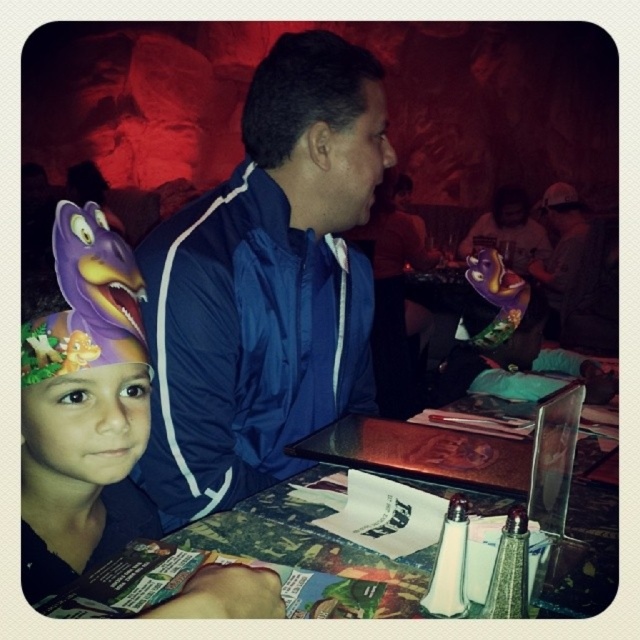
Question: Is blue nylon jacket at center in front of purple fabric headband at left?

Choices:
 (A) no
 (B) yes

Answer: (A)

Question: Among these points, which one is farthest from the camera?

Choices:
 (A) (67, 563)
 (B) (342, 129)

Answer: (B)

Question: Which point appears farthest from the camera in this image?

Choices:
 (A) (304, 38)
 (B) (60, 230)

Answer: (A)

Question: Can you confirm if blue nylon jacket at center is thinner than purple fabric headband at left?

Choices:
 (A) yes
 (B) no

Answer: (B)

Question: Among these points, which one is nearest to the camera?

Choices:
 (A) (353, 164)
 (B) (24, 490)

Answer: (B)

Question: Is blue nylon jacket at center wider than purple fabric headband at left?

Choices:
 (A) no
 (B) yes

Answer: (B)